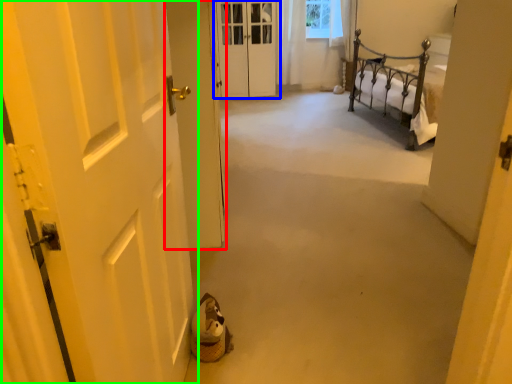
Question: Based on their relative distances, which object is farther from door (highlighted by a red box)? Choose from door (highlighted by a blue box) and door (highlighted by a green box).

Choices:
 (A) door
 (B) door

Answer: (A)